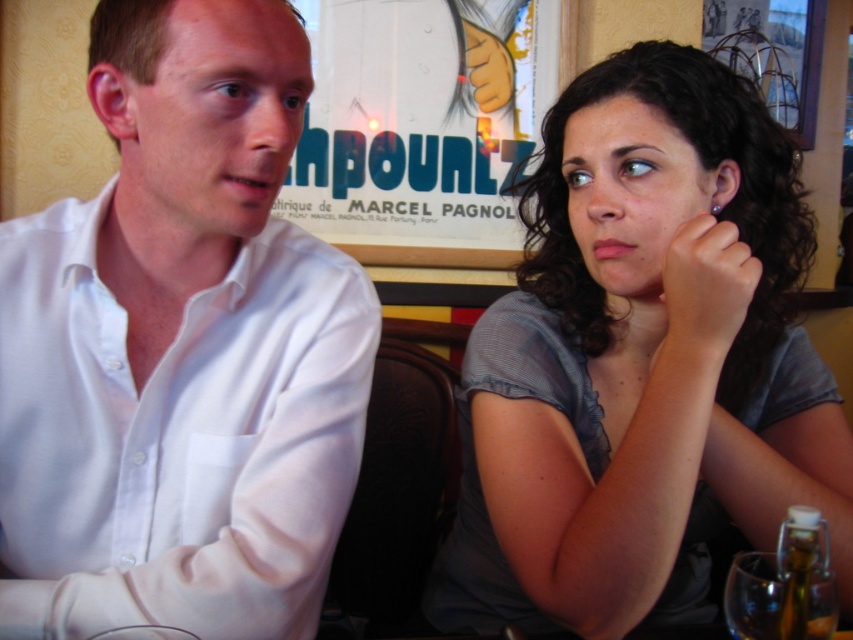
You are a photographer trying to capture a candid shot of both the white smooth shirt at left and the gray sheer blouse at upper right in the same frame. Given their spatial arrangement, which clothing item will appear smaller in the final photo?

The white smooth shirt at left will appear smaller in the final photo because it occupies less space than the gray sheer blouse at upper right.